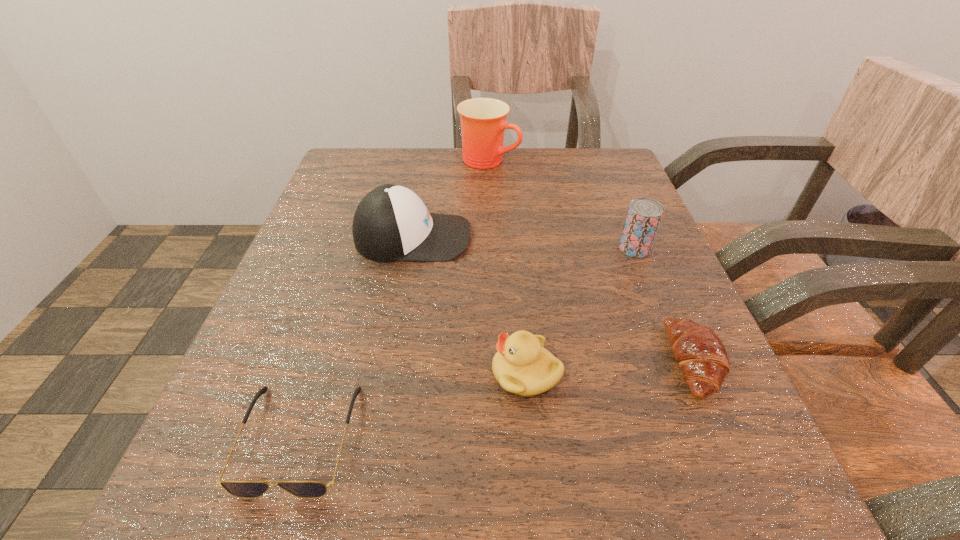
At what (x,y) coordinates should I click in order to perform the action: click on object that stands as the closest to the cap. Please return your answer as a coordinate pair (x, y). The width and height of the screenshot is (960, 540). Looking at the image, I should click on (483, 120).

Identify the location of free space that satisfies the following two spatial constraints: 1. on the front panel of the cap; 2. on the left side of the crescent roll. The height and width of the screenshot is (540, 960). (391, 361).